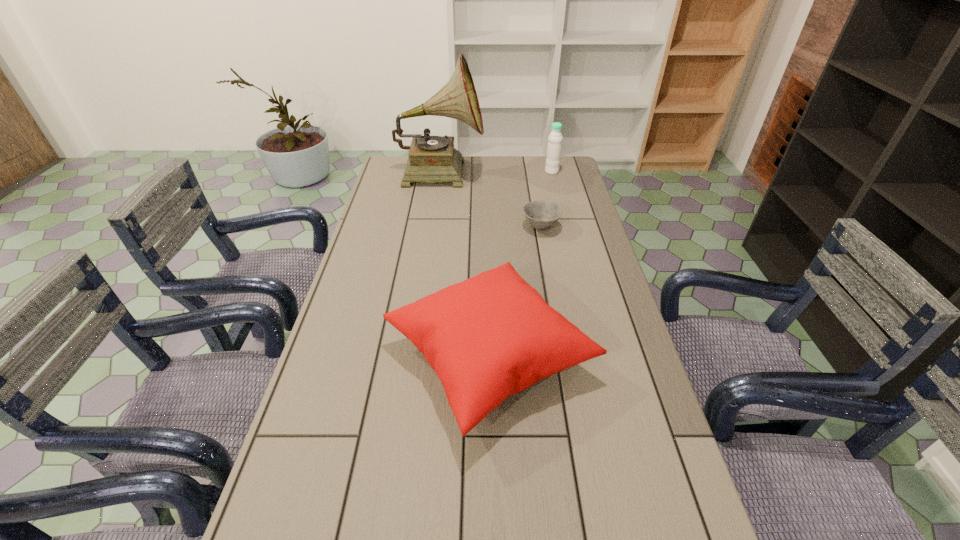
At what (x,y) coordinates should I click in order to perform the action: click on vacant point that satisfies the following two spatial constraints: 1. on the back side of the third tallest object; 2. from the horn of the record player. Please return your answer as a coordinate pair (x, y). Looking at the image, I should click on (486, 172).

Identify the location of free space in the image that satisfies the following two spatial constraints: 1. from the horn of the record player; 2. on the left side of the third farthest object. The width and height of the screenshot is (960, 540). coord(433,226).

The height and width of the screenshot is (540, 960). What are the coordinates of `vacant region that satisfies the following two spatial constraints: 1. from the horn of the record player; 2. on the left side of the third shortest object` in the screenshot? It's located at (441, 172).